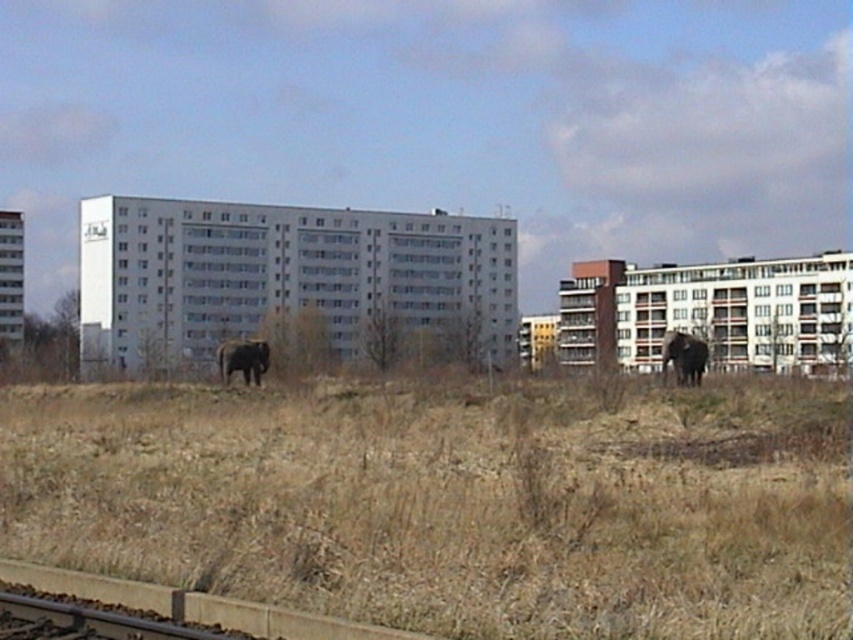
You are standing at the point marked as point (682, 337). There are two elephants 44.85 meters apart from each other. If you want to visit both elephants, which one should you go to first to minimize the total distance you walk?

To minimize the total distance walked, you should visit the closer elephant first. However, without knowing the exact positions of the elephants relative to your starting point, it is impossible to determine which one is closer. You would need additional information about their locations to decide the optimal path.

Consider the image. You are standing at the center of the image and want to locate the dark brown elephant at right. According to the coordinates provided, in which direction should you look to find it?

The dark brown elephant at right is located at coordinates point (683, 356), which means you should look to the right side of the image to find it.

You are a city planner reviewing this urban area. You notice the brown dry grass at center and the dark brown elephant at right. Which of these two features is taller?

The dark brown elephant at right is taller than the brown dry grass at center.